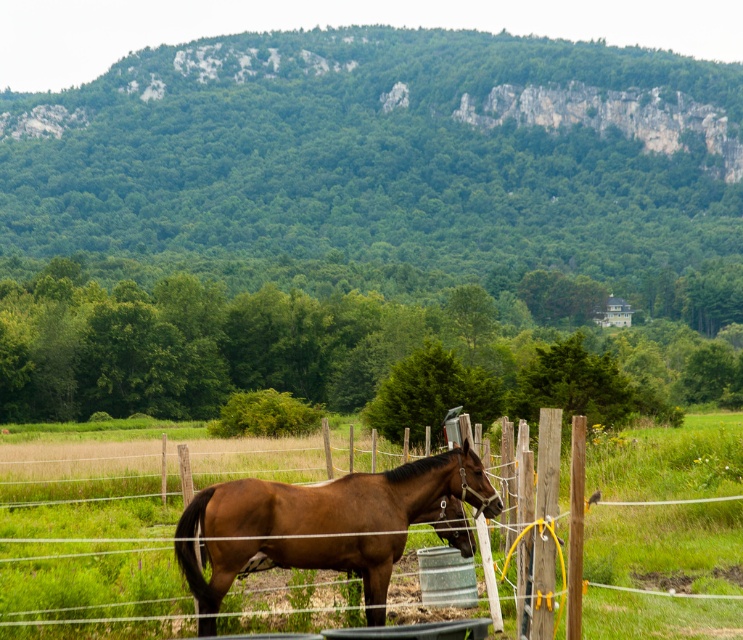
Question: Can you confirm if green leafy hillside at upper center is positioned above wooden post fence at center?

Choices:
 (A) no
 (B) yes

Answer: (B)

Question: Which point is closer to the camera taking this photo?

Choices:
 (A) (403, 477)
 (B) (322, 483)

Answer: (A)

Question: Among these points, which one is farthest from the camera?

Choices:
 (A) (405, 538)
 (B) (591, 161)

Answer: (B)

Question: Which of the following is the closest to the observer?

Choices:
 (A) green leafy hillside at upper center
 (B) brown glossy horse at center
 (C) wooden post fence at center

Answer: (C)

Question: Does green leafy hillside at upper center have a lesser width compared to brown glossy horse at center?

Choices:
 (A) yes
 (B) no

Answer: (B)

Question: Can you confirm if green leafy hillside at upper center is bigger than brown glossy horse at center?

Choices:
 (A) yes
 (B) no

Answer: (A)